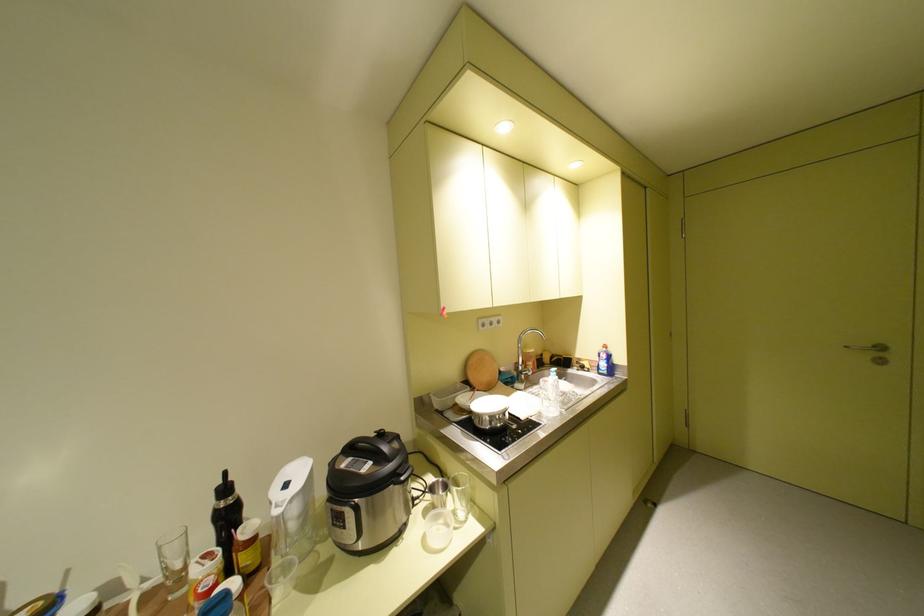
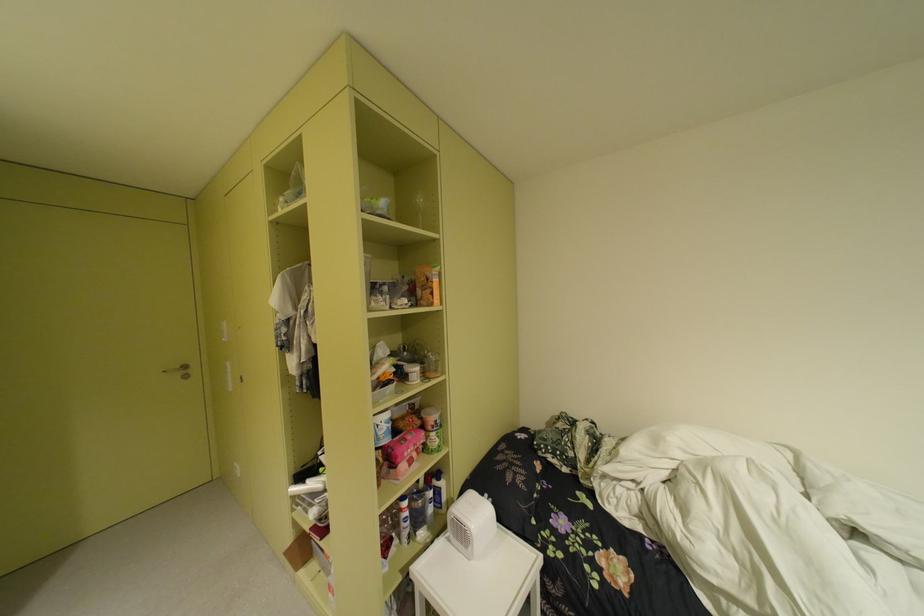
Find the pixel in the second image that matches (857,347) in the first image.

(175, 371)